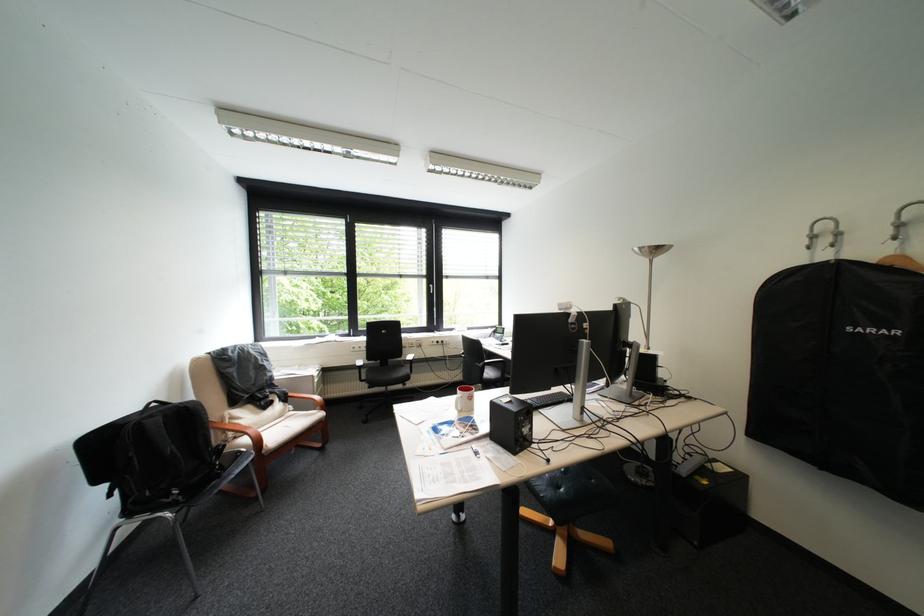
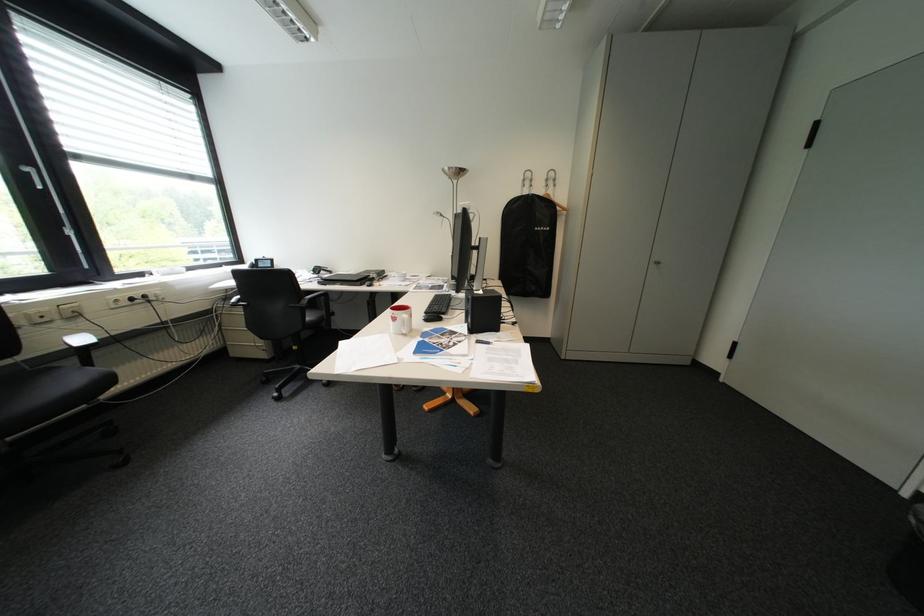
In the second image, find the point that corresponds to point (482, 399) in the first image.

(423, 315)